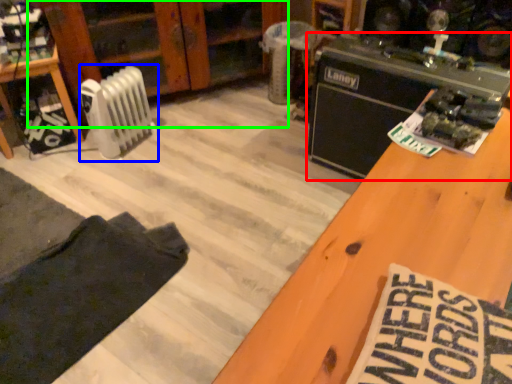
Question: Which object is the farthest from appliance (highlighted by a red box)? Choose among these: radiator (highlighted by a blue box) or dresser (highlighted by a green box).

Choices:
 (A) radiator
 (B) dresser

Answer: (A)